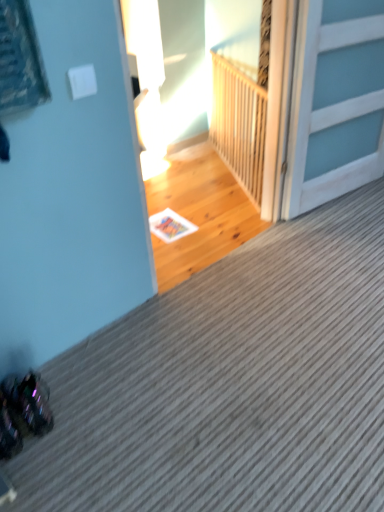
The height and width of the screenshot is (512, 384). In order to click on wooden at upper center in this screenshot , I will do `click(239, 123)`.

What is the approximate width of wooden at upper center?

It is 10.00 centimeters.

What do you see at coordinates (239, 123) in the screenshot? I see `wooden at upper center` at bounding box center [239, 123].

The height and width of the screenshot is (512, 384). Describe the element at coordinates (335, 102) in the screenshot. I see `white wooden door at upper right` at that location.

Measure the distance between point (286, 212) and camera.

Point (286, 212) is 2.29 meters from camera.

Where is `white wooden door at upper right`? The height and width of the screenshot is (512, 384). white wooden door at upper right is located at coordinates (335, 102).

Find the location of a particular element. The width and height of the screenshot is (384, 512). wooden at upper center is located at coordinates (239, 123).

Between white wooden door at upper right and wooden at upper center, which one appears on the right side from the viewer's perspective?

Positioned to the right is white wooden door at upper right.

Considering the positions of objects white wooden door at upper right and wooden at upper center in the image provided, who is behind, white wooden door at upper right or wooden at upper center?

wooden at upper center is more distant.

Which is closer, (378, 150) or (212, 103)?

Point (378, 150) appears to be closer to the viewer than point (212, 103).

From the image's perspective, which is above, white wooden door at upper right or wooden at upper center?

From the image's view, wooden at upper center is above.

From a real-world perspective, who is located lower, white wooden door at upper right or wooden at upper center?

From a 3D spatial view, wooden at upper center is below.

Which object is thinner, white wooden door at upper right or wooden at upper center?

With smaller width is wooden at upper center.

Considering the relative sizes of white wooden door at upper right and wooden at upper center in the image provided, is white wooden door at upper right taller than wooden at upper center?

Yes, white wooden door at upper right is taller than wooden at upper center.

Considering the sizes of white wooden door at upper right and wooden at upper center in the image, is white wooden door at upper right bigger or smaller than wooden at upper center?

In the image, white wooden door at upper right appears to be larger than wooden at upper center.

Is white wooden door at upper right spatially inside wooden at upper center, or outside of it?

white wooden door at upper right is not inside wooden at upper center, it's outside.

Are white wooden door at upper right and wooden at upper center far apart?

That's not correct — white wooden door at upper right is a little close to wooden at upper center.

Is white wooden door at upper right looking in the opposite direction of wooden at upper center?

Absolutely, white wooden door at upper right is directed away from wooden at upper center.

How many degrees apart are the facing directions of white wooden door at upper right and wooden at upper center?

114 degrees.

Measure the distance from white wooden door at upper right to wooden at upper center.

white wooden door at upper right and wooden at upper center are 19.04 inches apart.

Locate an element on the screen. This screenshot has width=384, height=512. balustrade to the left of white wooden door at upper right is located at coordinates (239, 123).

Which object is positioned more to the right, wooden at upper center or white wooden door at upper right?

From the viewer's perspective, white wooden door at upper right appears more on the right side.

Relative to white wooden door at upper right, is wooden at upper center in front or behind?

In the image, wooden at upper center appears behind white wooden door at upper right.

Considering the points (254, 175) and (323, 184), which point is behind, point (254, 175) or point (323, 184)?

The point (254, 175) is farther.

From the image's perspective, which is above, wooden at upper center or white wooden door at upper right?

wooden at upper center is shown above in the image.

From a real-world perspective, is wooden at upper center positioned above or below white wooden door at upper right?

From a real-world perspective, wooden at upper center is physically below white wooden door at upper right.

Is wooden at upper center wider or thinner than white wooden door at upper right?

In the image, wooden at upper center appears to be more narrow than white wooden door at upper right.

Considering the sizes of objects wooden at upper center and white wooden door at upper right in the image provided, who is shorter, wooden at upper center or white wooden door at upper right?

wooden at upper center is shorter.

Considering the sizes of wooden at upper center and white wooden door at upper right in the image, is wooden at upper center bigger or smaller than white wooden door at upper right?

wooden at upper center is smaller than white wooden door at upper right.

Is white wooden door at upper right completely or partially inside wooden at upper center?

No, wooden at upper center does not contain white wooden door at upper right.

Is wooden at upper center beside white wooden door at upper right?

No, wooden at upper center is not touching white wooden door at upper right.

Is wooden at upper center aimed at white wooden door at upper right?

No, wooden at upper center is not oriented towards white wooden door at upper right.

How distant is wooden at upper center from white wooden door at upper right?

wooden at upper center is 19.04 inches from white wooden door at upper right.

What are the coordinates of `door above the wooden at upper center (from a real-world perspective)` in the screenshot? It's located at (335, 102).

Identify the location of balustrade above the white wooden door at upper right (from the image's perspective). (239, 123).

Find the location of a particular element. Image resolution: width=384 pixels, height=512 pixels. door on the right of the wooden at upper center is located at coordinates (335, 102).